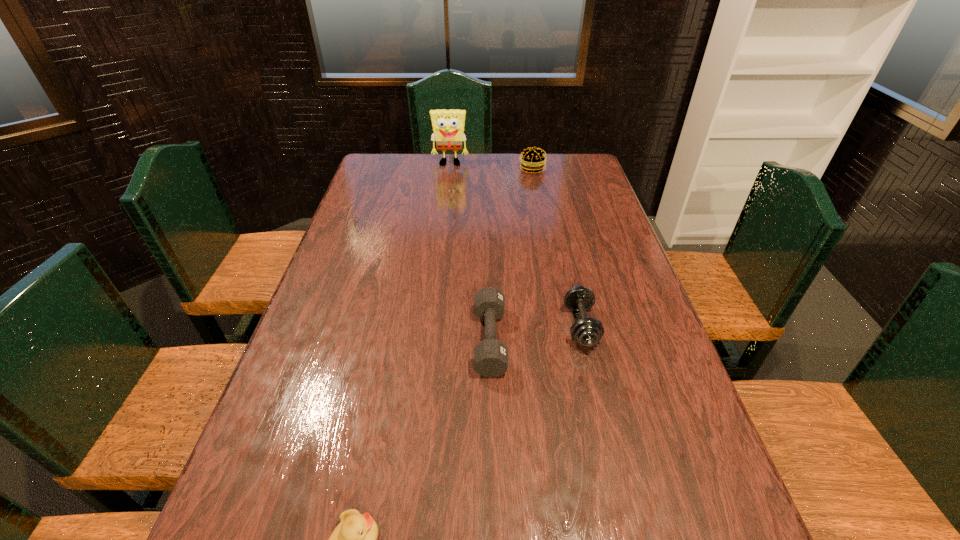
Locate an element on the screen. The height and width of the screenshot is (540, 960). sponge is located at coordinates (448, 125).

You are a GUI agent. You are given a task and a screenshot of the screen. Output one action in this format:
    pyautogui.click(x=<x>, y=<y>)
    Task: Click on the patty
    The image size is (960, 540).
    Given the screenshot: What is the action you would take?
    pyautogui.click(x=532, y=160)

The height and width of the screenshot is (540, 960). Identify the location of the right dumbbell. (587, 332).

Locate an element on the screen. The height and width of the screenshot is (540, 960). the third object from left to right is located at coordinates pos(490,355).

The width and height of the screenshot is (960, 540). Find the location of `free space located on the face of the tallest object`. free space located on the face of the tallest object is located at coordinates (446, 198).

Where is `vacant position located 0.250m on the left of the patty`? The width and height of the screenshot is (960, 540). vacant position located 0.250m on the left of the patty is located at coordinates (456, 169).

At what (x,y) coordinates should I click in order to perform the action: click on vacant space situated on the left of the right dumbbell. Please return your answer as a coordinate pair (x, y). The image size is (960, 540). Looking at the image, I should click on (511, 326).

At what (x,y) coordinates should I click in order to perform the action: click on blank area located on the back of the left dumbbell. Please return your answer as a coordinate pair (x, y). This screenshot has width=960, height=540. Looking at the image, I should click on (488, 241).

In order to click on sponge that is at the far edge in this screenshot , I will do `click(448, 125)`.

I want to click on patty located at the far edge, so click(x=532, y=160).